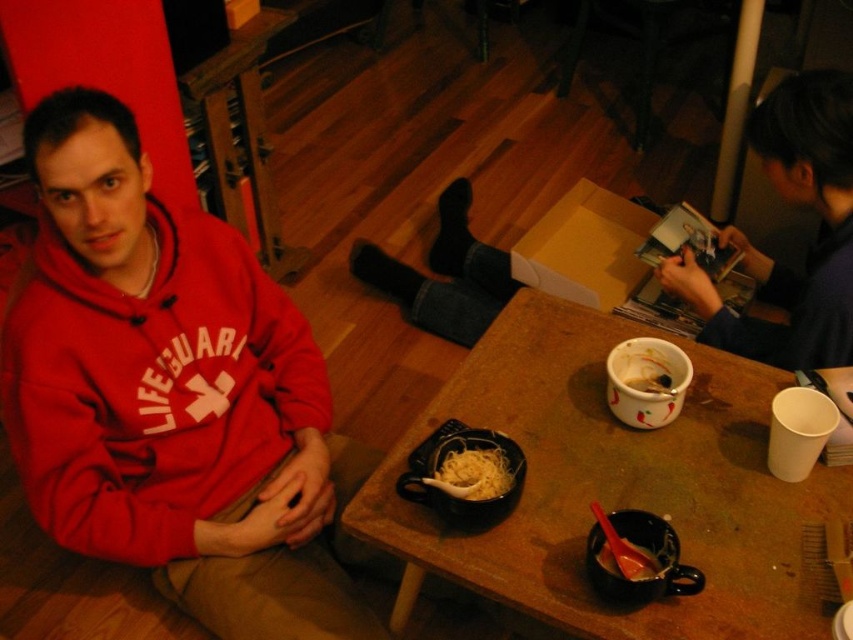
Question: Can you confirm if matte red hoodie at left is bigger than matte black mug with spoon at lower center?

Choices:
 (A) yes
 (B) no

Answer: (A)

Question: Where is dark blue fabric at upper right located in relation to smooth plastic spoon at lower center in the image?

Choices:
 (A) above
 (B) below

Answer: (A)

Question: Which point is farther from the camera taking this photo?

Choices:
 (A) (515, 563)
 (B) (811, 200)
 (C) (486, 442)

Answer: (B)

Question: Where is matte black bowl at center located in relation to yellow noodle at center in the image?

Choices:
 (A) right
 (B) left

Answer: (B)

Question: Which point is closer to the camera?

Choices:
 (A) (583, 548)
 (B) (598, 506)
 (C) (189, 464)
 (D) (502, 468)

Answer: (B)

Question: Which object is the closest to the dark blue fabric at upper right?

Choices:
 (A) wooden table at center
 (B) matte black mug with spoon at lower center
 (C) white glossy bowl at center
 (D) speckled ceramic cup at center

Answer: (A)